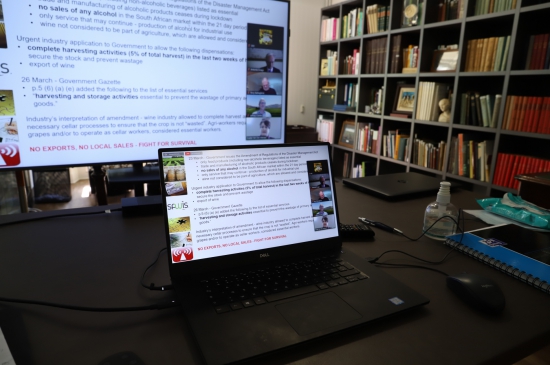
Find the location of a particular element. outlet is located at coordinates (302, 110).